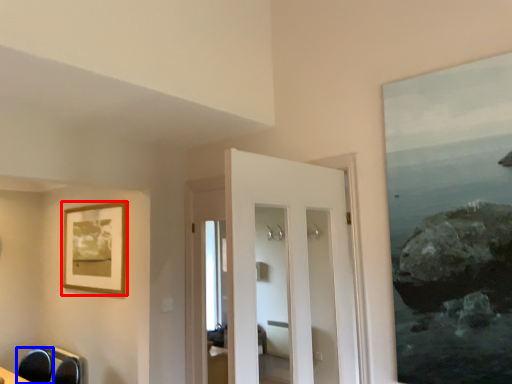
Question: Which object appears farthest to the camera in this image, picture frame (highlighted by a red box) or swivel chair (highlighted by a blue box)?

Choices:
 (A) picture frame
 (B) swivel chair

Answer: (A)